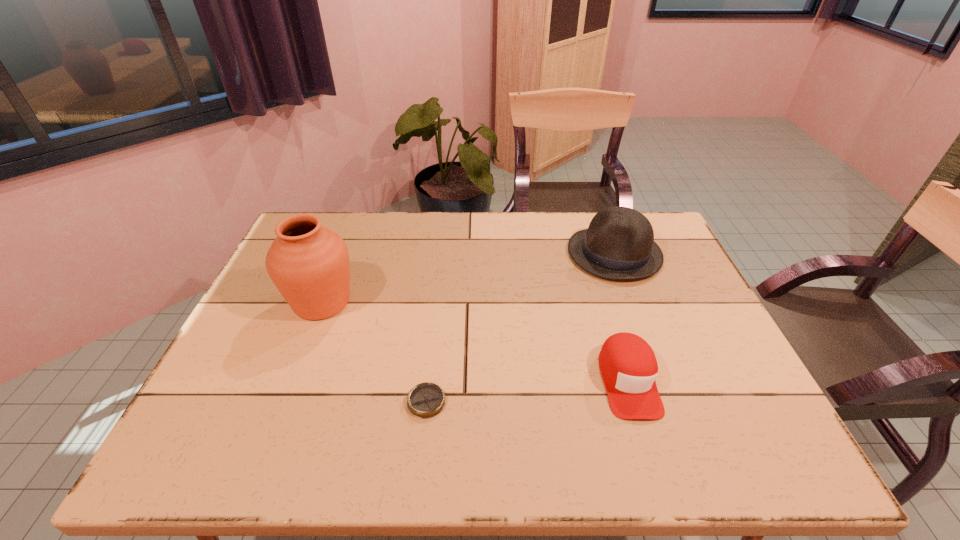
The height and width of the screenshot is (540, 960). In order to click on vacant space at the near right corner of the desktop in this screenshot , I will do `click(723, 444)`.

This screenshot has width=960, height=540. What are the coordinates of `vacant point located between the tallest object and the third object from right to left` in the screenshot? It's located at (374, 352).

Where is `blank region between the compass and the baseball cap`? The height and width of the screenshot is (540, 960). blank region between the compass and the baseball cap is located at coordinates (527, 391).

Where is `free space between the third shortest object and the baseball cap`? The image size is (960, 540). free space between the third shortest object and the baseball cap is located at coordinates (621, 317).

At what (x,y) coordinates should I click in order to perform the action: click on empty location between the tallest object and the bowler hat. Please return your answer as a coordinate pair (x, y). The width and height of the screenshot is (960, 540). Looking at the image, I should click on (468, 278).

At what (x,y) coordinates should I click in order to perform the action: click on vacant region between the urn and the third shortest object. Please return your answer as a coordinate pair (x, y). This screenshot has height=540, width=960. Looking at the image, I should click on (468, 278).

The width and height of the screenshot is (960, 540). What are the coordinates of `vacant space that is in between the shortest object and the second shortest object` in the screenshot? It's located at (527, 391).

Where is `vacant area between the third object from right to left and the second shortest object`? vacant area between the third object from right to left and the second shortest object is located at coordinates (527, 391).

Locate an element on the screen. The image size is (960, 540). free spot between the tallest object and the compass is located at coordinates (374, 352).

You are a GUI agent. You are given a task and a screenshot of the screen. Output one action in this format:
    pyautogui.click(x=<x>, y=<y>)
    Task: Click on the vacant point located between the shortest object and the third shortest object
    Image resolution: width=960 pixels, height=540 pixels.
    Given the screenshot: What is the action you would take?
    pyautogui.click(x=520, y=327)